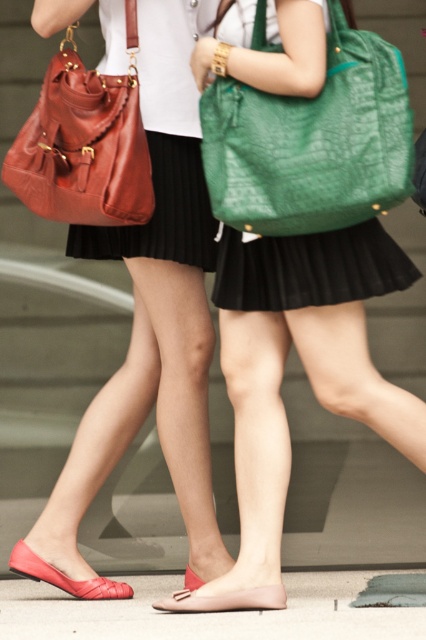
You are a photographer trying to capture a close shot of the pavement between the two people. Given that your camera can only focus on objects larger than the matte pink leather sandal at lower center, will the smooth concrete pavement at lower center be in focus?

The smooth concrete pavement at lower center is bigger than the matte pink leather sandal at lower center, so yes, the smooth concrete pavement at lower center will be in focus.

From the picture: You are standing at the point with coordinates point (46, 112) and want to walk to the point with coordinates point (316, 193). Based on the scene, will you need to walk forward or backward to reach your destination?

You will need to walk forward to reach point (316, 193) because it is in front of point (46, 112).

You are a pedestrian walking on the smooth concrete pavement at lower center and see the matte red sandal at lower left. Which object is closer to you?

The smooth concrete pavement at lower center is closer to you than the matte red sandal at lower left.